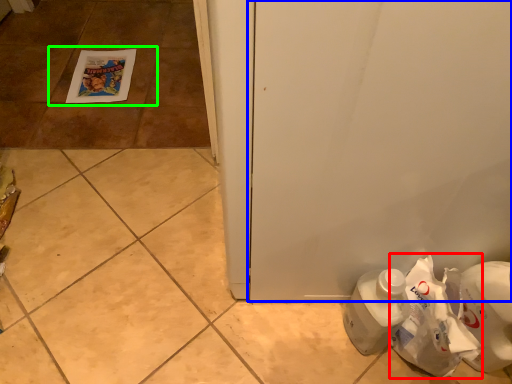
Question: Which is farther away from paper bag (highlighted by a red box)? door (highlighted by a blue box) or tile (highlighted by a green box)?

Choices:
 (A) door
 (B) tile

Answer: (B)